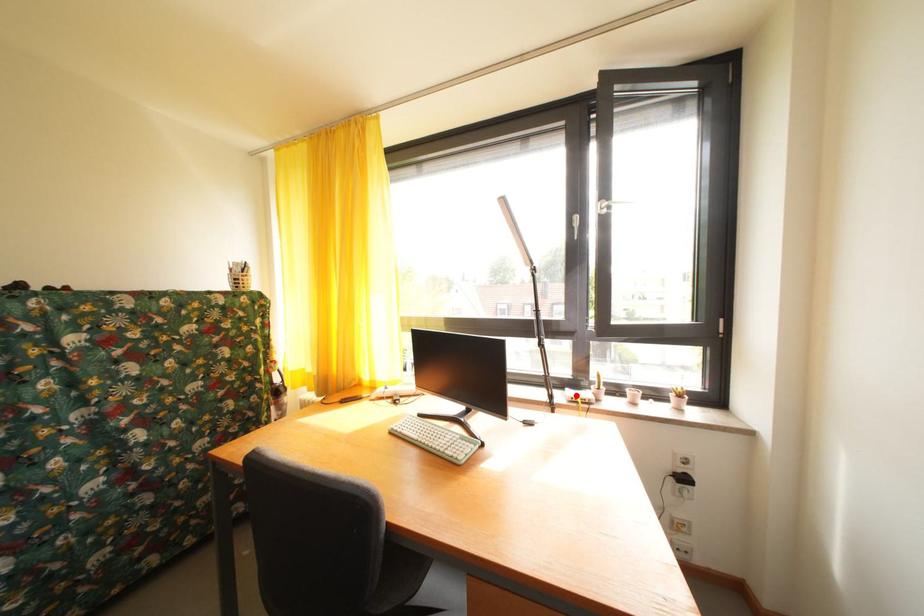
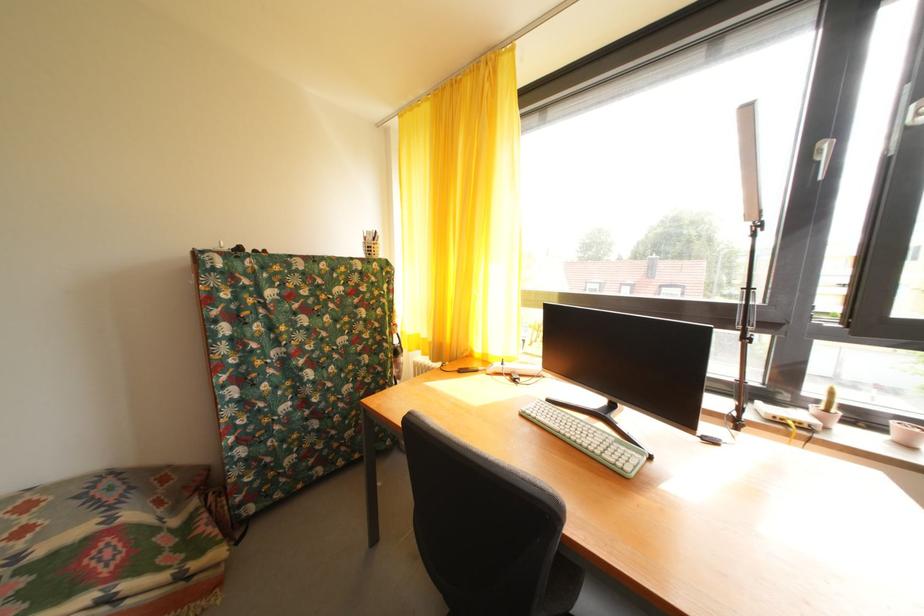
In the second image, find the point that corresponds to the highlighted location in the first image.

(768, 408)